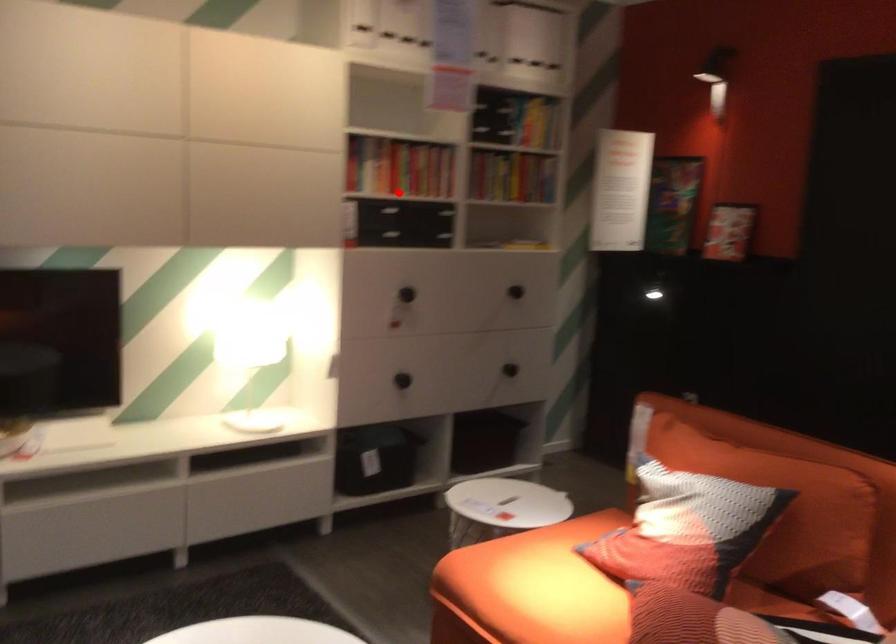
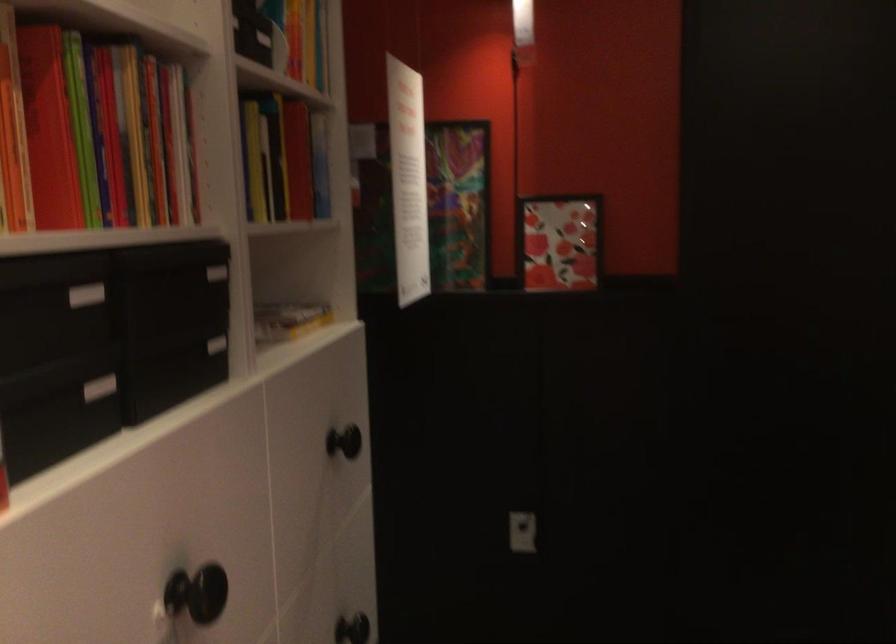
Question: I am providing you with two images of the same scene from different viewpoints. A red point is shown in image1. For the corresponding object point in image2, is it positioned nearer or farther from the camera?

Choices:
 (A) Nearer
 (B) Farther

Answer: (A)